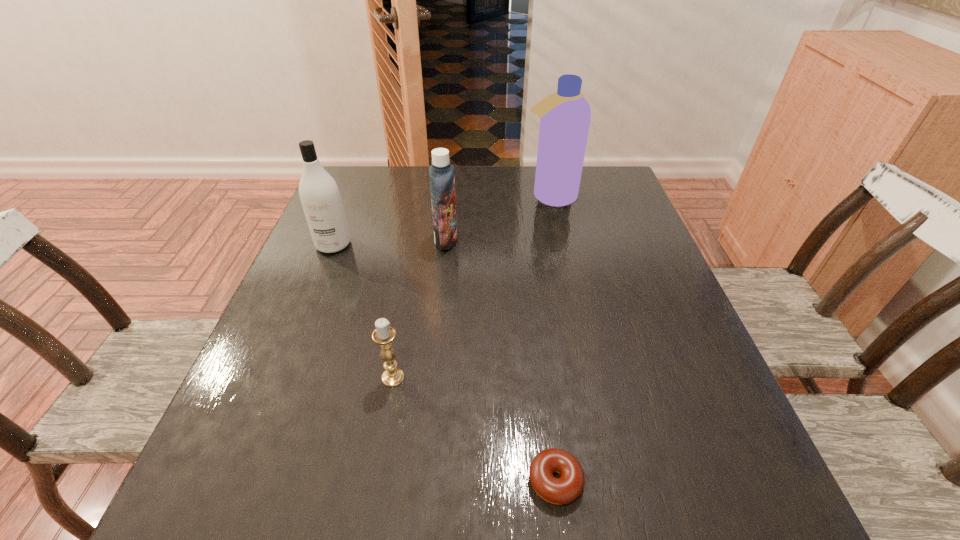
Locate an element on the screen. The height and width of the screenshot is (540, 960). free location that satisfies the following two spatial constraints: 1. on the back side of the shortest object; 2. on the right side of the rightmost shampoo is located at coordinates (520, 197).

Find the location of a particular element. This screenshot has width=960, height=540. vacant space that satisfies the following two spatial constraints: 1. on the front label of the second shampoo from left to right; 2. on the front-facing side of the leftmost object is located at coordinates (445, 245).